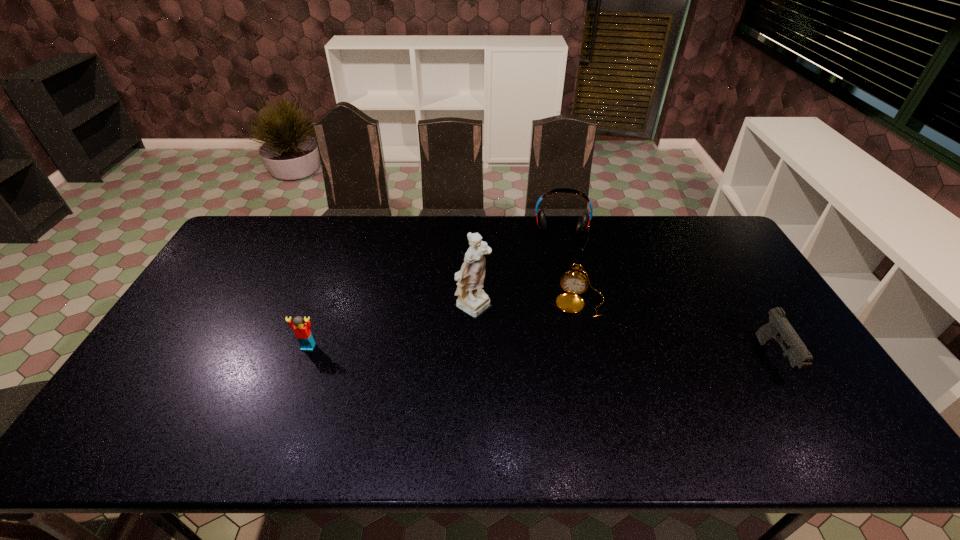
You are a GUI agent. You are given a task and a screenshot of the screen. Output one action in this format:
    pyautogui.click(x=<x>, y=<y>)
    Task: Click on the leftmost object
    The image size is (960, 540).
    Given the screenshot: What is the action you would take?
    pyautogui.click(x=302, y=330)

Where is `pistol`? pistol is located at coordinates (778, 328).

You are a GUI agent. You are given a task and a screenshot of the screen. Output one action in this format:
    pyautogui.click(x=<x>, y=<y>)
    Task: Click on the fourth object from right to left
    
    Given the screenshot: What is the action you would take?
    pyautogui.click(x=472, y=299)

Where is `the tallest object`? Image resolution: width=960 pixels, height=540 pixels. the tallest object is located at coordinates pyautogui.click(x=472, y=299).

Where is `headset`? headset is located at coordinates (583, 225).

Where is `the second tallest object`? This screenshot has width=960, height=540. the second tallest object is located at coordinates (583, 225).

At what (x,y) coordinates should I click in order to perform the action: click on pocket watch. Please return your answer as a coordinate pair (x, y). Looking at the image, I should click on (574, 282).

Locate an element on the screen. vacant space located 0.060m on the face of the leftmost object is located at coordinates (300, 369).

Where is `vacant position located at the barrel of the pistol`? The width and height of the screenshot is (960, 540). vacant position located at the barrel of the pistol is located at coordinates (801, 404).

Locate an element on the screen. This screenshot has width=960, height=540. blank space located on the front-facing side of the figurine is located at coordinates (596, 368).